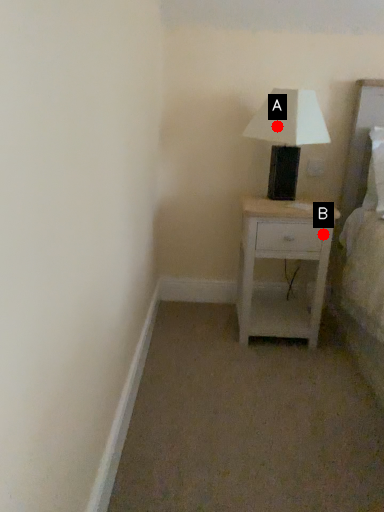
Question: Two points are circled on the image, labeled by A and B beside each circle. Among these points, which one is nearest to the camera?

Choices:
 (A) A is closer
 (B) B is closer

Answer: (A)